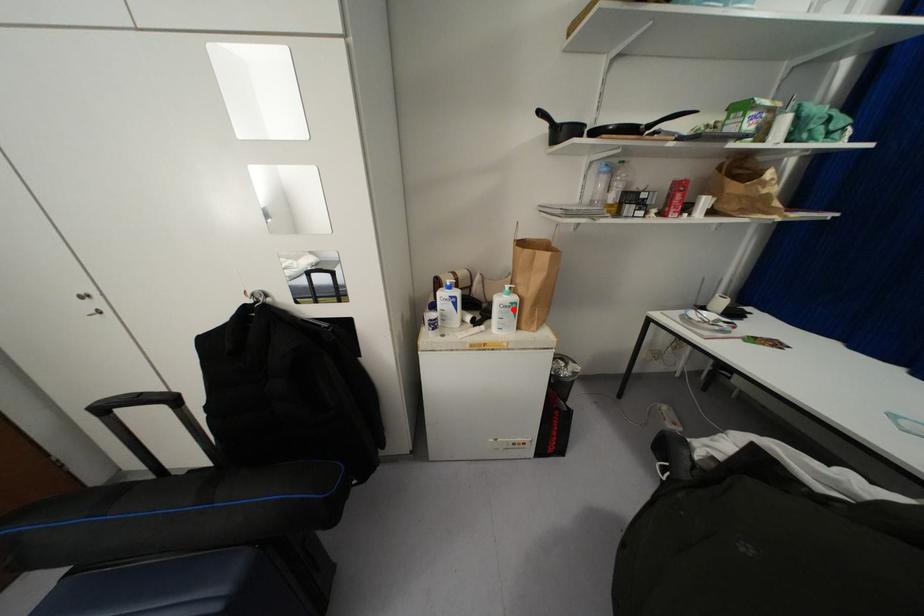
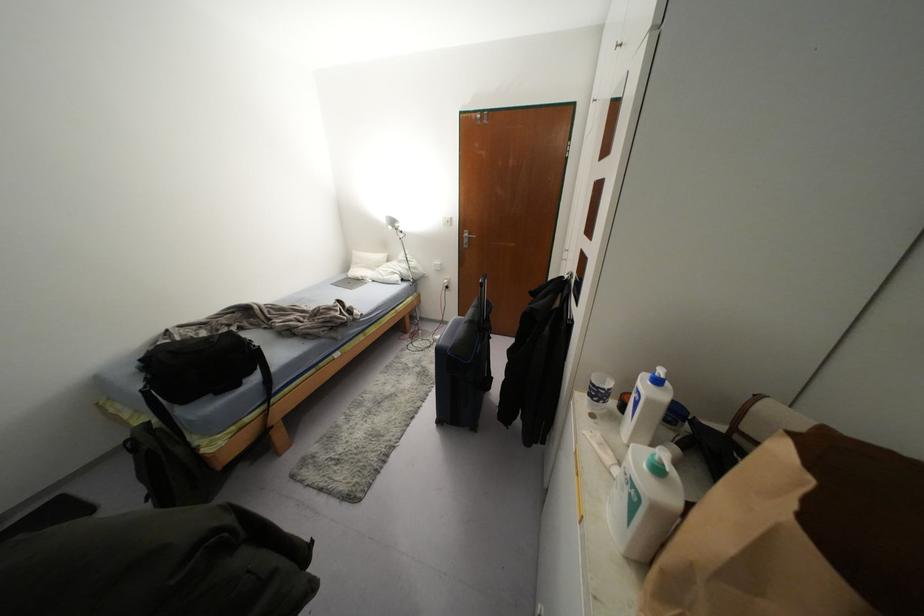
Find the pixel in the second image that matches the highlighted location in the first image.

(633, 505)